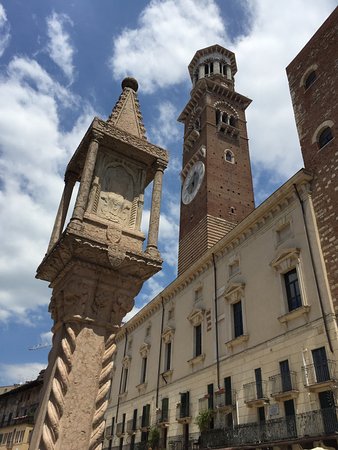
Locate an element on the screen. plant is located at coordinates (202, 416).